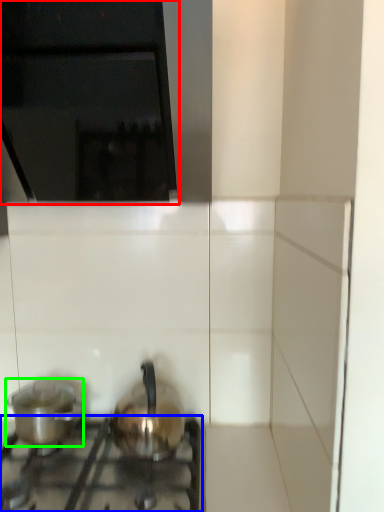
Question: Which object is the farthest from vent (highlighted by a red box)? Choose among these: gas stove (highlighted by a blue box) or kitchen appliance (highlighted by a green box).

Choices:
 (A) gas stove
 (B) kitchen appliance

Answer: (A)